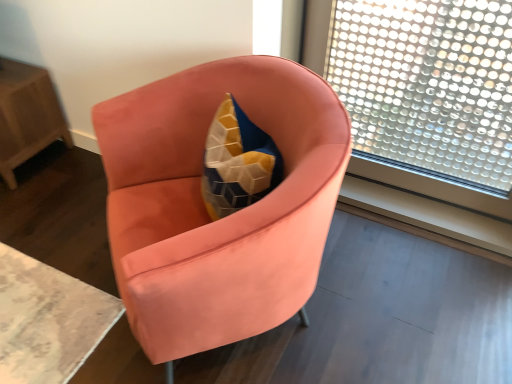
Where is `vacant region to the left of satin coral armchair at center`? vacant region to the left of satin coral armchair at center is located at coordinates (66, 274).